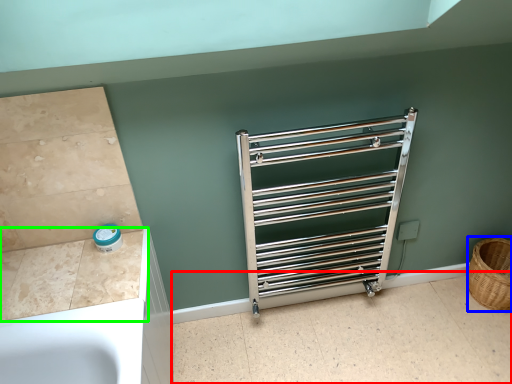
Question: Based on their relative distances, which object is farther from tile (highlighted by a red box)? Choose from basket (highlighted by a blue box) and counter top (highlighted by a green box).

Choices:
 (A) basket
 (B) counter top

Answer: (B)